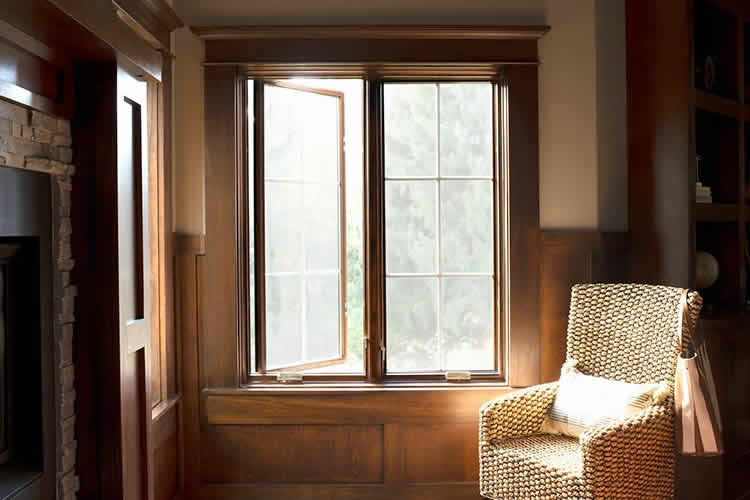
Find the location of `back of chair`. back of chair is located at coordinates (649, 349).